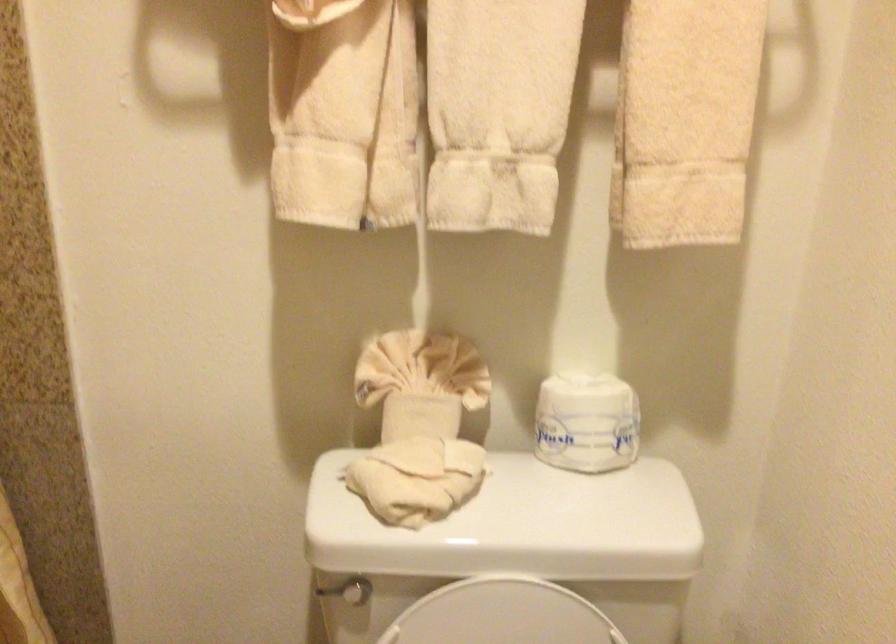
The image size is (896, 644). What do you see at coordinates (587, 422) in the screenshot?
I see `the toilet paper roll` at bounding box center [587, 422].